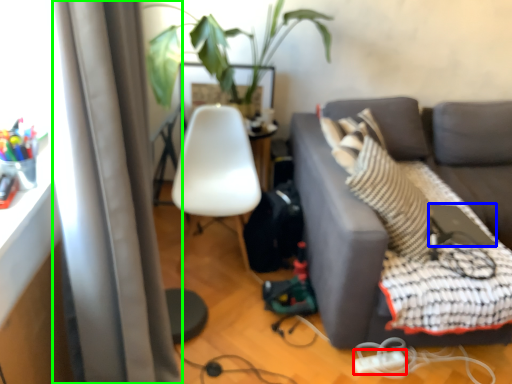
Question: Which is nearer to the extension cord (highlighted by a red box)? computer (highlighted by a blue box) or curtain (highlighted by a green box).

Choices:
 (A) computer
 (B) curtain

Answer: (A)